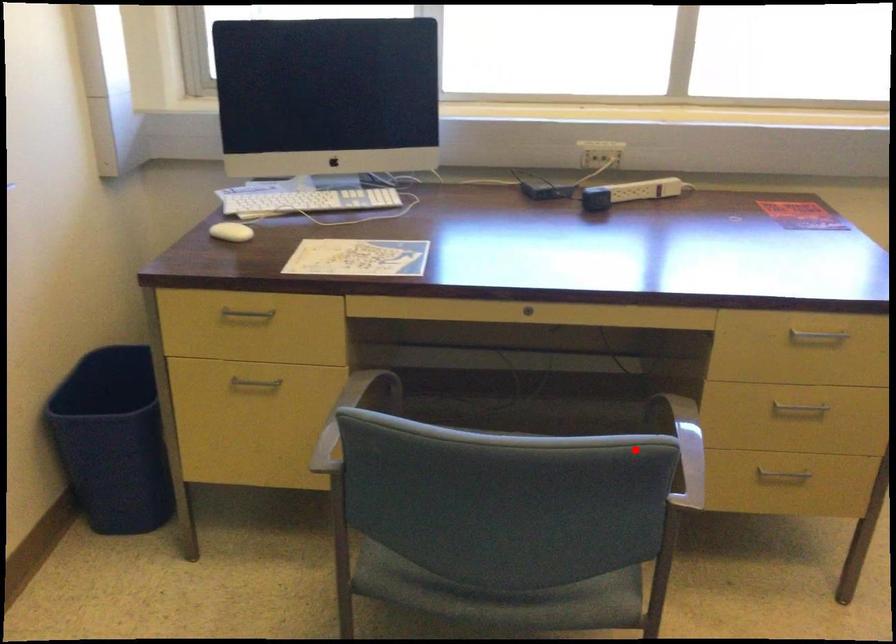
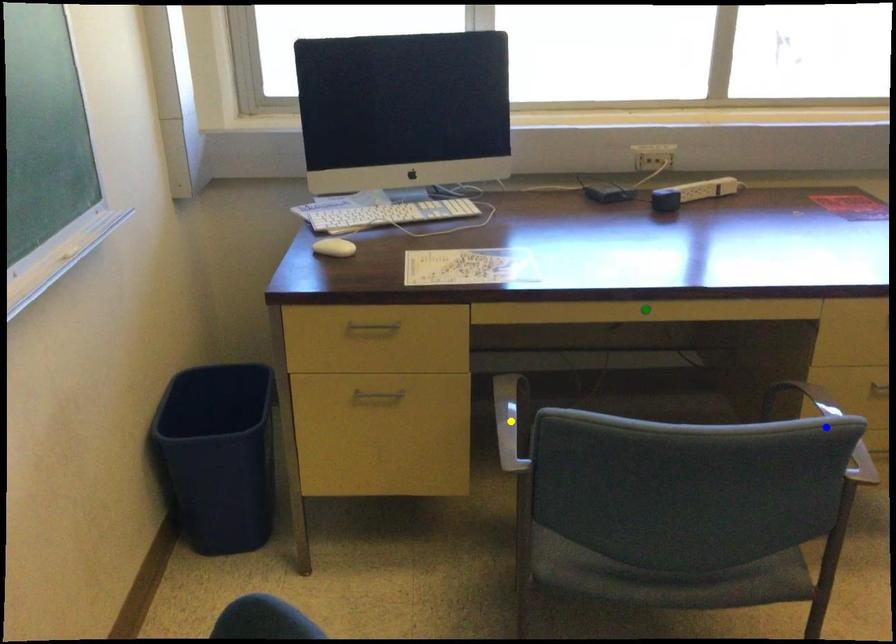
Question: I am providing you with two images of the same scene from different viewpoints. A red point is marked on the first image. You are given multiple points on the second image. Which point in image 2 represents the same 3d spot as the red point in image 1?

Choices:
 (A) blue point
 (B) yellow point
 (C) green point

Answer: (A)